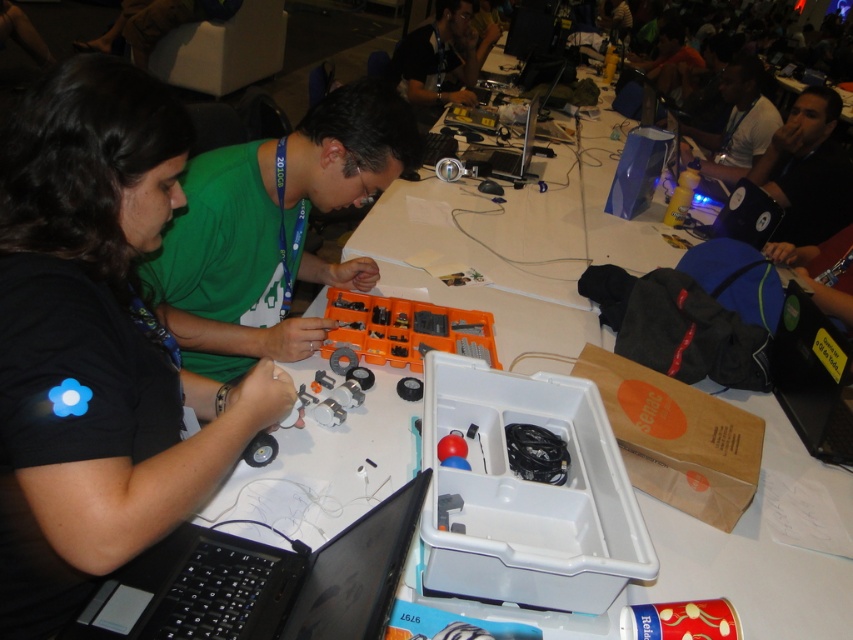
Which is in front, point (3, 608) or point (817, 426)?

Point (3, 608)

The width and height of the screenshot is (853, 640). Identify the location of black matte shirt at left. (97, 344).

Which of these two, black plastic computer at lower right or matte black laptop at upper right, stands shorter?

With less height is black plastic computer at lower right.

Does point (788, 412) come behind point (735, 56)?

That is False.

You are a GUI agent. You are given a task and a screenshot of the screen. Output one action in this format:
    pyautogui.click(x=<x>, y=<y>)
    Task: Click on the black plastic computer at lower right
    This screenshot has width=853, height=640.
    Given the screenshot: What is the action you would take?
    pyautogui.click(x=811, y=376)

Is black plastic computer at lower right closer to the viewer compared to black plastic laptop at upper right?

Yes, black plastic computer at lower right is in front of black plastic laptop at upper right.

Does point (782, 371) come behind point (747, 214)?

No, it is not.

Which is in front, point (839, 426) or point (741, 186)?

Positioned in front is point (839, 426).

Locate an element on the screen. This screenshot has height=640, width=853. black plastic computer at lower right is located at coordinates (811, 376).